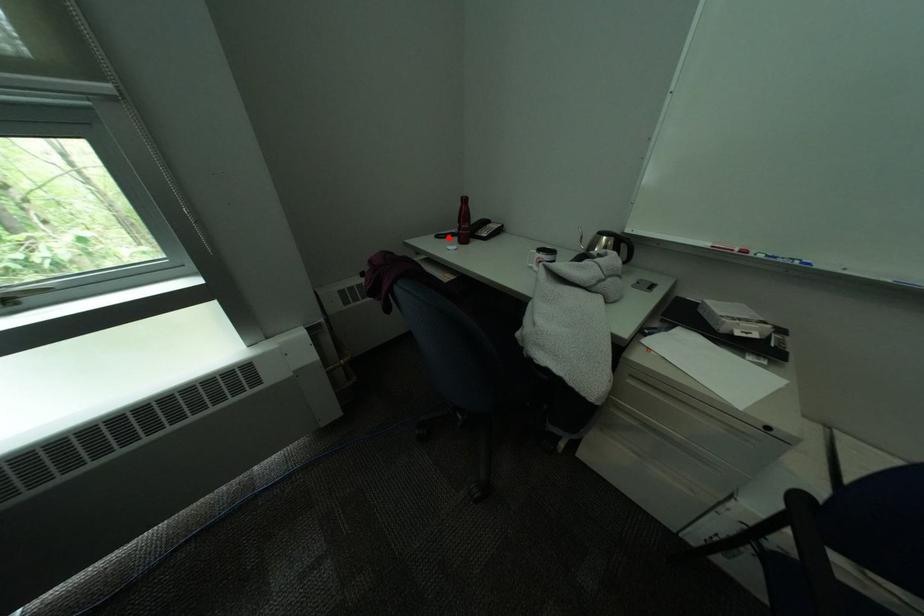
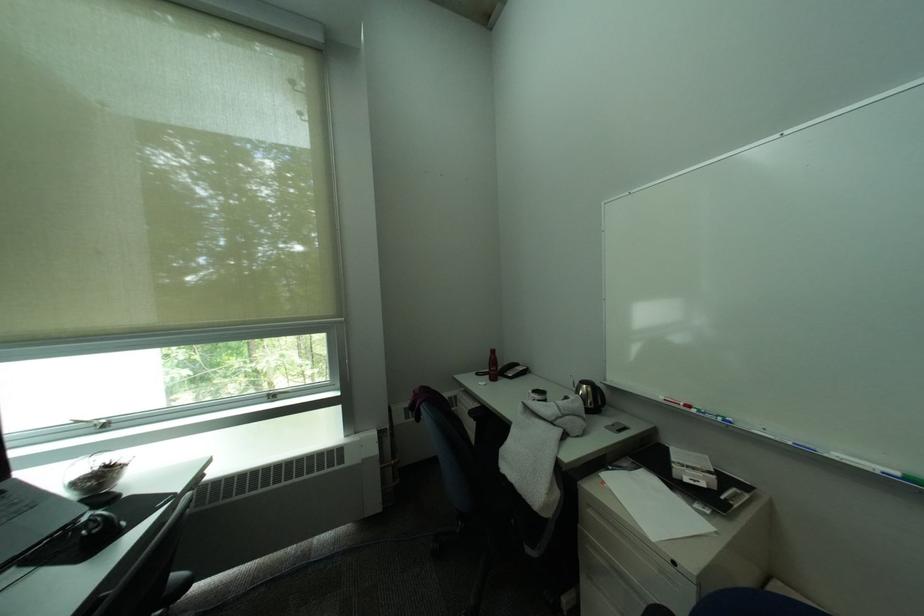
Question: I am providing you with two images of the same scene from different viewpoints. A red point is marked on the first image. Can you still see the location of the red point in image 2?

Choices:
 (A) Yes
 (B) No

Answer: (A)